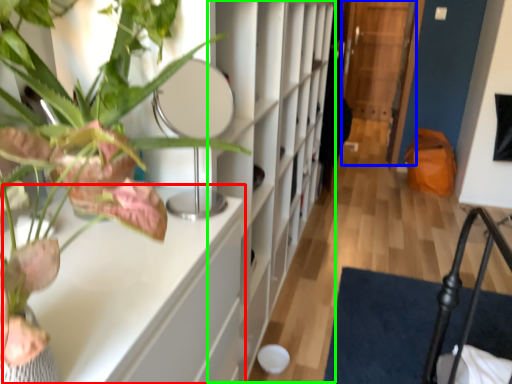
Question: Which is nearer to the table (highlighted by a red box)? glass door (highlighted by a blue box) or bookshelf (highlighted by a green box).

Choices:
 (A) glass door
 (B) bookshelf

Answer: (B)